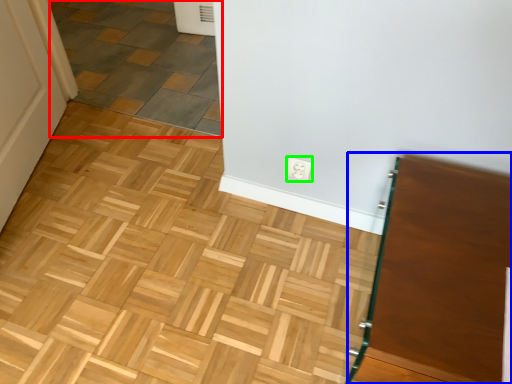
Question: Which is farther away from tile (highlighted by a red box)? vanity (highlighted by a blue box) or electric outlet (highlighted by a green box)?

Choices:
 (A) vanity
 (B) electric outlet

Answer: (A)